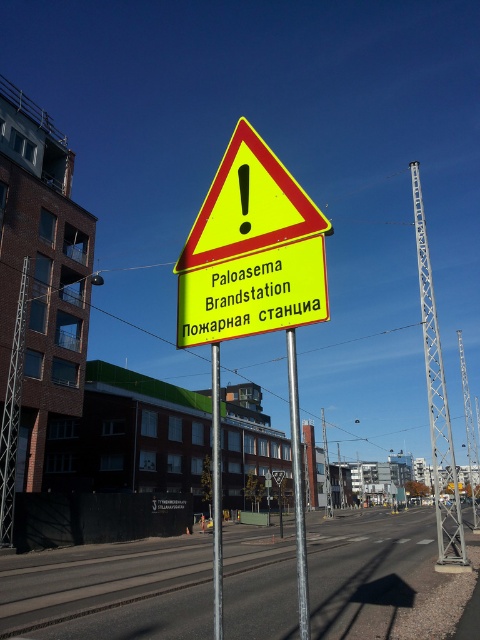
You are a pedestrian standing in front of the yellow reflective triangle at center and the yellow plastic signpost at center. Which object is closer to you?

The yellow reflective triangle at center is closer to you because the yellow plastic signpost at center is behind it.

You are a delivery driver who needs to park your truck near the yellow reflective triangle at center and the yellow plastic signpost at center. The truck requires a minimum of 15 feet of space to maneuver. Can you safely park your truck between these two objects?

The yellow reflective triangle at center is 14.50 feet away from the yellow plastic signpost at center. Since the truck needs at least 15 feet of space to maneuver, the distance between them is insufficient. Therefore, you cannot safely park your truck between these two objects.